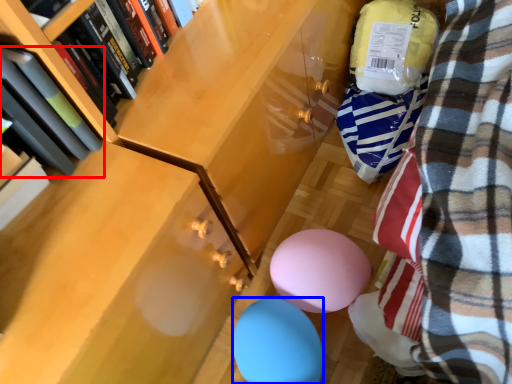
Question: Which of the following is the farthest to the observer, book (highlighted by a red box) or balloon (highlighted by a blue box)?

Choices:
 (A) book
 (B) balloon

Answer: (B)